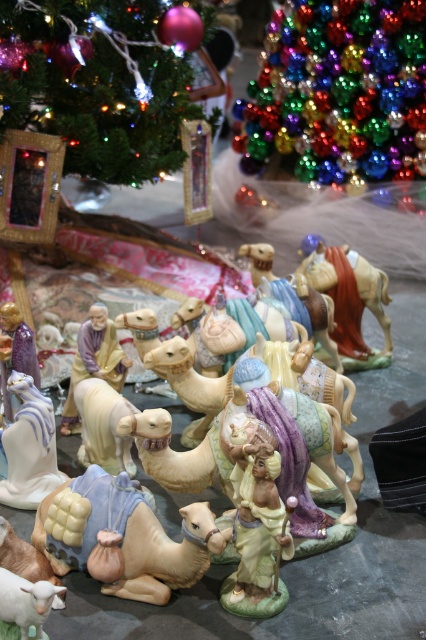
Question: Does shiny metallic ornament at upper center appear on the right side of matte beige camel at center?

Choices:
 (A) no
 (B) yes

Answer: (A)

Question: Which point is closer to the camera taking this photo?

Choices:
 (A) (48, 416)
 (B) (97, 554)

Answer: (B)

Question: Which object is farther from the camera taking this photo?

Choices:
 (A) multicolored glass ornaments at upper center
 (B) matte beige camel at center
 (C) shiny metallic ornament at upper center
 (D) porcelain camel at center

Answer: (A)

Question: Which is nearer to the multicolored glass ornaments at upper center?

Choices:
 (A) porcelain camel at center
 (B) white glossy figurine at center
 (C) shiny metallic ornament at upper center
 (D) matte beige camel at center

Answer: (C)

Question: Is multicolored glass ornaments at upper center above shiny metallic ornament at upper center?

Choices:
 (A) no
 (B) yes

Answer: (B)

Question: Is shiny metallic ornament at upper center to the left of white glossy figurine at center from the viewer's perspective?

Choices:
 (A) yes
 (B) no

Answer: (B)